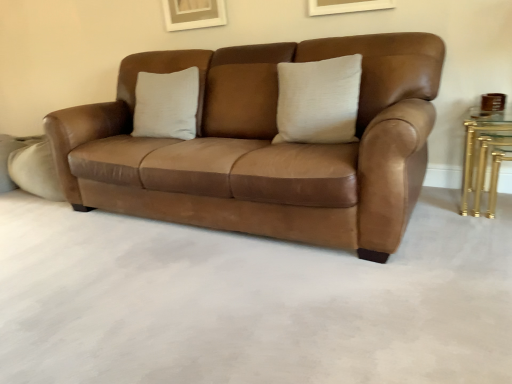
Question: Is satin beige pillow at center directly adjacent to gold metallic table at right?

Choices:
 (A) yes
 (B) no

Answer: (B)

Question: Considering the relative positions of satin beige pillow at center and gold metallic table at right in the image provided, is satin beige pillow at center behind gold metallic table at right?

Choices:
 (A) yes
 (B) no

Answer: (B)

Question: Considering the relative sizes of satin beige pillow at center and gold metallic table at right in the image provided, is satin beige pillow at center smaller than gold metallic table at right?

Choices:
 (A) yes
 (B) no

Answer: (B)

Question: From a real-world perspective, is satin beige pillow at center physically above gold metallic table at right?

Choices:
 (A) no
 (B) yes

Answer: (B)

Question: From the image's perspective, does satin beige pillow at center appear higher than gold metallic table at right?

Choices:
 (A) no
 (B) yes

Answer: (B)

Question: Considering the relative sizes of satin beige pillow at center and gold metallic table at right in the image provided, is satin beige pillow at center wider than gold metallic table at right?

Choices:
 (A) yes
 (B) no

Answer: (B)

Question: Is suede leather couch at center not within gold metallic table at right?

Choices:
 (A) yes
 (B) no

Answer: (A)

Question: Can you confirm if suede leather couch at center is taller than gold metallic table at right?

Choices:
 (A) no
 (B) yes

Answer: (B)

Question: Is gold metallic table at right located within suede leather couch at center?

Choices:
 (A) yes
 (B) no

Answer: (B)

Question: Can you confirm if suede leather couch at center is smaller than gold metallic table at right?

Choices:
 (A) yes
 (B) no

Answer: (B)

Question: From the image's perspective, is suede leather couch at center above gold metallic table at right?

Choices:
 (A) no
 (B) yes

Answer: (B)

Question: From a real-world perspective, is suede leather couch at center physically above gold metallic table at right?

Choices:
 (A) yes
 (B) no

Answer: (A)

Question: Considering the relative sizes of gold metallic table at right and satin beige pillow at center in the image provided, is gold metallic table at right smaller than satin beige pillow at center?

Choices:
 (A) no
 (B) yes

Answer: (B)